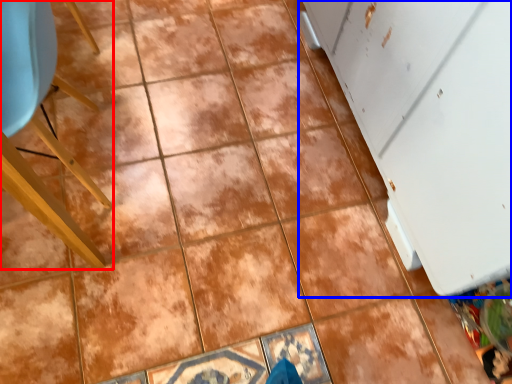
Question: Which object is closer to the camera taking this photo, furniture (highlighted by a red box) or screen door (highlighted by a blue box)?

Choices:
 (A) furniture
 (B) screen door

Answer: (B)